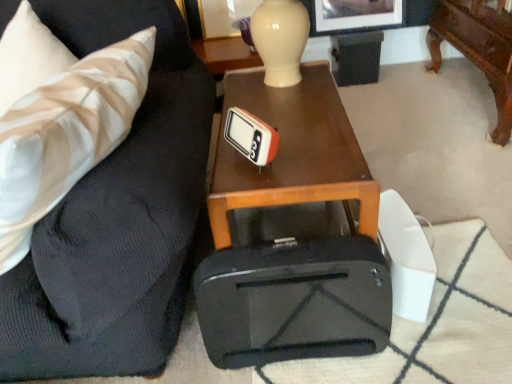
Where is `free space in front of white plastic thermometer at center`? The width and height of the screenshot is (512, 384). free space in front of white plastic thermometer at center is located at coordinates (259, 187).